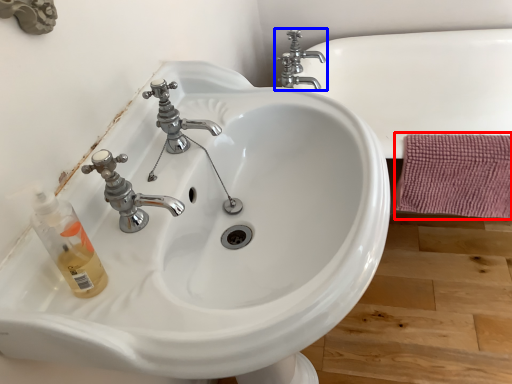
Question: Which object appears farthest to the camera in this image, bath towel (highlighted by a red box) or tap (highlighted by a blue box)?

Choices:
 (A) bath towel
 (B) tap

Answer: (B)